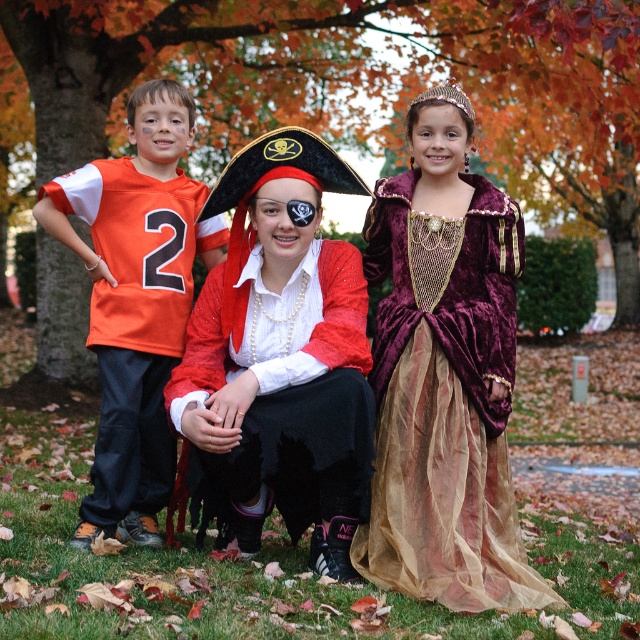
Question: Which object is closer to the camera taking this photo?

Choices:
 (A) velvet maroon dress at center
 (B) orange jersey at left
 (C) shiny red fabric pirate costume at center

Answer: (A)

Question: Is shiny red fabric pirate costume at center smaller than orange jersey at left?

Choices:
 (A) yes
 (B) no

Answer: (A)

Question: Which object is farther from the camera taking this photo?

Choices:
 (A) shiny red fabric pirate costume at center
 (B) velvet maroon dress at center

Answer: (A)

Question: Is shiny red fabric pirate costume at center above orange jersey at left?

Choices:
 (A) no
 (B) yes

Answer: (A)

Question: Is shiny red fabric pirate costume at center wider than orange jersey at left?

Choices:
 (A) yes
 (B) no

Answer: (A)

Question: Which object is farther from the camera taking this photo?

Choices:
 (A) velvet maroon dress at center
 (B) orange jersey at left
 (C) shiny red fabric pirate costume at center

Answer: (B)